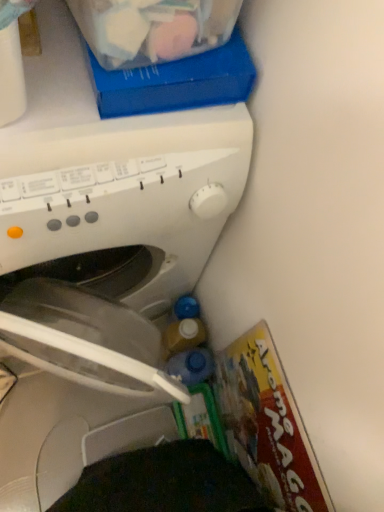
Question: Can you confirm if white plastic washing machine at center is shorter than matte cardboard magazine at lower right?

Choices:
 (A) no
 (B) yes

Answer: (A)

Question: From a real-world perspective, is white plastic washing machine at center physically below matte cardboard magazine at lower right?

Choices:
 (A) no
 (B) yes

Answer: (A)

Question: Could you tell me if white plastic washing machine at center is turned towards matte cardboard magazine at lower right?

Choices:
 (A) yes
 (B) no

Answer: (A)

Question: Is matte cardboard magazine at lower right inside white plastic washing machine at center?

Choices:
 (A) no
 (B) yes

Answer: (A)

Question: Can you confirm if white plastic washing machine at center is wider than matte cardboard magazine at lower right?

Choices:
 (A) no
 (B) yes

Answer: (B)

Question: Considering the positions of point (145, 394) and point (208, 364), is point (145, 394) closer or farther from the camera than point (208, 364)?

Choices:
 (A) farther
 (B) closer

Answer: (B)

Question: From a real-world perspective, is white plastic washing machine at center above or below blue translucent bottle at lower right?

Choices:
 (A) below
 (B) above

Answer: (B)

Question: Would you say white plastic washing machine at center is to the left or to the right of blue translucent bottle at lower right in the picture?

Choices:
 (A) left
 (B) right

Answer: (A)

Question: Considering the positions of white plastic washing machine at center and blue translucent bottle at lower right in the image, is white plastic washing machine at center taller or shorter than blue translucent bottle at lower right?

Choices:
 (A) short
 (B) tall

Answer: (B)

Question: Considering the relative positions of white plastic washing machine at center and matte cardboard magazine at lower right in the image provided, is white plastic washing machine at center to the left or to the right of matte cardboard magazine at lower right?

Choices:
 (A) left
 (B) right

Answer: (A)

Question: From their relative heights in the image, would you say white plastic washing machine at center is taller or shorter than matte cardboard magazine at lower right?

Choices:
 (A) tall
 (B) short

Answer: (A)

Question: From the image's perspective, is white plastic washing machine at center located above or below matte cardboard magazine at lower right?

Choices:
 (A) above
 (B) below

Answer: (A)

Question: Considering the positions of white plastic washing machine at center and matte cardboard magazine at lower right in the image, is white plastic washing machine at center bigger or smaller than matte cardboard magazine at lower right?

Choices:
 (A) small
 (B) big

Answer: (B)

Question: Visually, is translucent plastic storage box at upper center positioned to the left or to the right of matte cardboard magazine at lower right?

Choices:
 (A) left
 (B) right

Answer: (A)

Question: Is translucent plastic storage box at upper center inside or outside of matte cardboard magazine at lower right?

Choices:
 (A) outside
 (B) inside

Answer: (A)